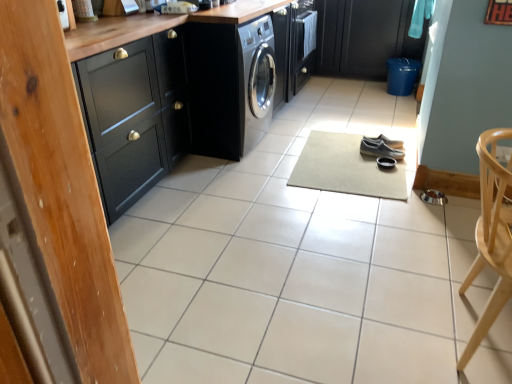
Question: Considering the relative sizes of dark grey canvas shoes at center, the second footwear when ordered from back to front, and black leather shoes at center, which is counted as the 2th footwear, starting from the front, in the image provided, is dark grey canvas shoes at center, the second footwear when ordered from back to front, bigger than black leather shoes at center, which is counted as the 2th footwear, starting from the front,?

Choices:
 (A) yes
 (B) no

Answer: (A)

Question: From a real-world perspective, is dark grey canvas shoes at center, the second footwear when ordered from back to front, beneath black leather shoes at center, marked as the 1th footwear in a back-to-front arrangement?

Choices:
 (A) no
 (B) yes

Answer: (B)

Question: Considering the relative sizes of dark grey canvas shoes at center, the first footwear positioned from the front, and black leather shoes at center, marked as the 1th footwear in a back-to-front arrangement, in the image provided, is dark grey canvas shoes at center, the first footwear positioned from the front, wider than black leather shoes at center, marked as the 1th footwear in a back-to-front arrangement,?

Choices:
 (A) no
 (B) yes

Answer: (A)

Question: Can you confirm if dark grey canvas shoes at center, the first footwear positioned from the front, is positioned to the left of black leather shoes at center, which is counted as the 2th footwear, starting from the front?

Choices:
 (A) no
 (B) yes

Answer: (B)

Question: Considering the relative sizes of dark grey canvas shoes at center, the second footwear when ordered from back to front, and black leather shoes at center, marked as the 1th footwear in a back-to-front arrangement, in the image provided, is dark grey canvas shoes at center, the second footwear when ordered from back to front, thinner than black leather shoes at center, marked as the 1th footwear in a back-to-front arrangement,?

Choices:
 (A) no
 (B) yes

Answer: (B)

Question: Are dark grey canvas shoes at center, the first footwear positioned from the front, and black leather shoes at center, which is counted as the 2th footwear, starting from the front, making contact?

Choices:
 (A) yes
 (B) no

Answer: (A)

Question: Considering the relative sizes of black matte cabinet at left, the 1th cabinetry when ordered from front to back, and beige carpet at center in the image provided, is black matte cabinet at left, the 1th cabinetry when ordered from front to back, bigger than beige carpet at center?

Choices:
 (A) no
 (B) yes

Answer: (B)

Question: Is the position of black matte cabinet at left, which ranks as the 2th cabinetry in top-to-bottom order, less distant than that of beige carpet at center?

Choices:
 (A) no
 (B) yes

Answer: (B)

Question: From a real-world perspective, is black matte cabinet at left, which ranks as the 2th cabinetry in top-to-bottom order, on beige carpet at center?

Choices:
 (A) no
 (B) yes

Answer: (B)

Question: Considering the relative sizes of black matte cabinet at left, which appears as the 1th cabinetry when viewed from the left, and beige carpet at center in the image provided, is black matte cabinet at left, which appears as the 1th cabinetry when viewed from the left, taller than beige carpet at center?

Choices:
 (A) no
 (B) yes

Answer: (B)

Question: Does black matte cabinet at left, which appears as the 1th cabinetry when viewed from the left, come behind beige carpet at center?

Choices:
 (A) yes
 (B) no

Answer: (B)

Question: Is beige carpet at center completely or partially inside black matte cabinet at left, which is the first cabinetry in bottom-to-top order?

Choices:
 (A) yes
 (B) no

Answer: (B)

Question: Is satin black washing machine at center further to camera compared to black leather shoes at center, which is counted as the 2th footwear, starting from the front?

Choices:
 (A) no
 (B) yes

Answer: (A)